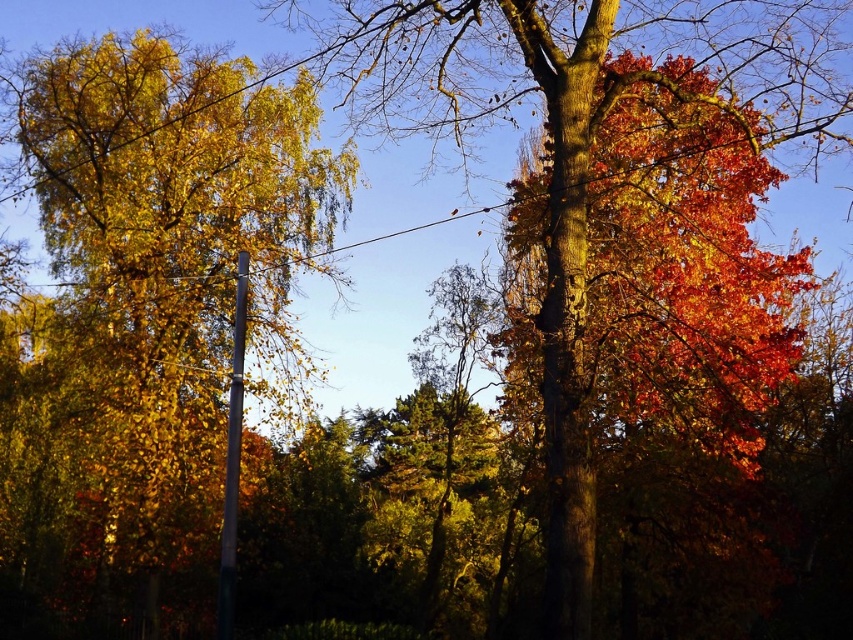
Does golden yellow leaves at left appear on the right side of metallic pole at left?

Incorrect, golden yellow leaves at left is not on the right side of metallic pole at left.

This screenshot has height=640, width=853. What do you see at coordinates (155, 292) in the screenshot? I see `golden yellow leaves at left` at bounding box center [155, 292].

Measure the distance between golden yellow leaves at left and camera.

golden yellow leaves at left is 14.43 meters away from camera.

The width and height of the screenshot is (853, 640). Identify the location of golden yellow leaves at left. (x=155, y=292).